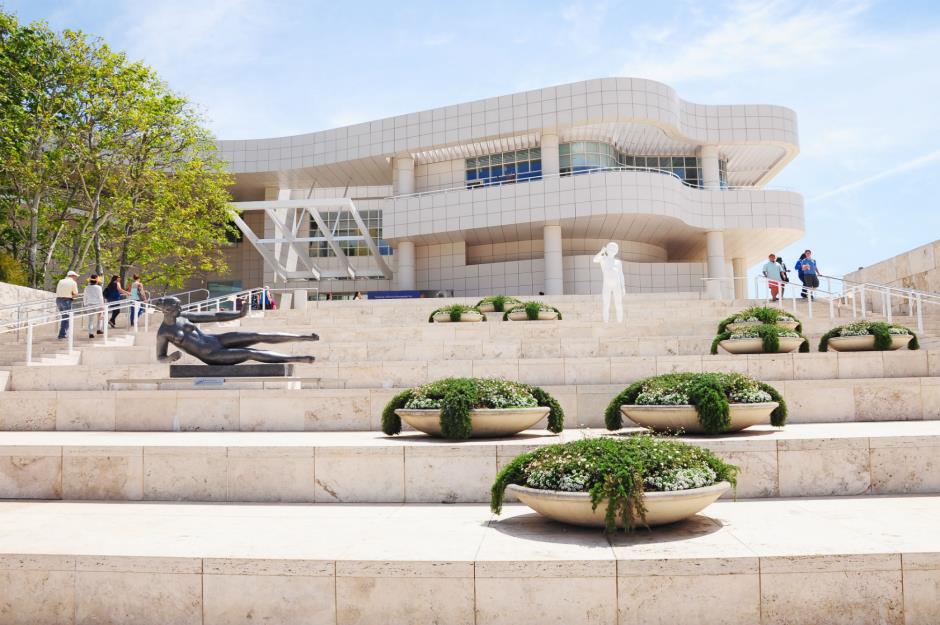
This screenshot has width=940, height=625. In order to click on stairs on the left side of the grand stairs in the center in this screenshot , I will do coord(43,358), coord(65,354), coord(117,340), coord(130,331).